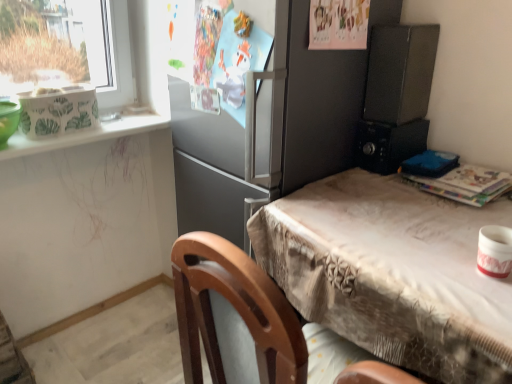
The width and height of the screenshot is (512, 384). I want to click on free location to the left of white glossy mug at upper right, which is the third appliance in back-to-front order, so tap(429, 269).